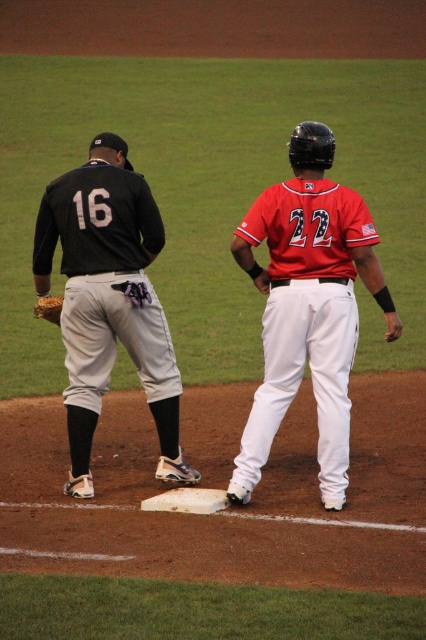
Question: Which point is farther from the camera taking this photo?

Choices:
 (A) (69, 186)
 (B) (55, 308)
 (C) (307, 129)

Answer: (B)

Question: Does red matte jersey at center lie behind brown leather glove at lower left?

Choices:
 (A) yes
 (B) no

Answer: (B)

Question: Does red matte jersey at center have a lesser width compared to brown leather glove at lower left?

Choices:
 (A) yes
 (B) no

Answer: (B)

Question: Estimate the real-world distances between objects in this image. Which object is closer to the red matte jersey at center?

Choices:
 (A) matte black jersey at left
 (B) brown leather glove at lower left

Answer: (A)

Question: Which object is positioned closest to the brown leather glove at lower left?

Choices:
 (A) red matte jersey at center
 (B) matte black jersey at left

Answer: (B)

Question: Can you confirm if red matte jersey at center is wider than brown leather glove at lower left?

Choices:
 (A) no
 (B) yes

Answer: (B)